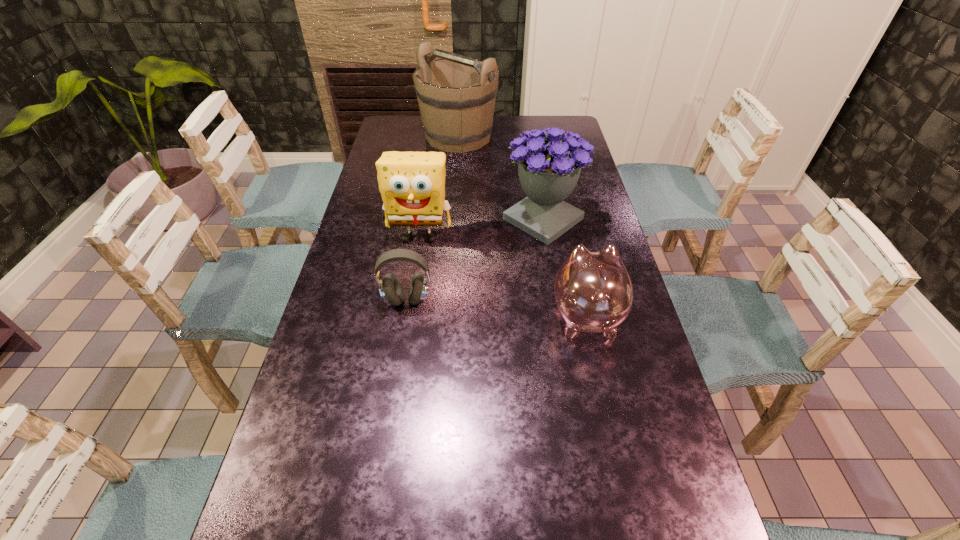
Locate an element on the screen. The image size is (960, 540). free location located on the front facing side of the piggy bank is located at coordinates (562, 204).

Image resolution: width=960 pixels, height=540 pixels. In order to click on free space located on the ear cups of the headset in this screenshot , I will do `click(401, 330)`.

Where is `object that is at the far edge`? Image resolution: width=960 pixels, height=540 pixels. object that is at the far edge is located at coordinates (456, 94).

This screenshot has height=540, width=960. Identify the location of bucket that is at the left edge. 456,94.

This screenshot has width=960, height=540. I want to click on sponge that is at the left edge, so click(x=412, y=184).

The image size is (960, 540). I want to click on headset situated at the left edge, so click(390, 288).

Where is `bouquet at the right edge`? This screenshot has width=960, height=540. bouquet at the right edge is located at coordinates (549, 170).

Identify the location of piggy bank that is at the right edge. (593, 290).

Identify the location of object that is at the far left corner. (456, 94).

At what (x,y) coordinates should I click in order to perform the action: click on vacant region at the left edge of the desktop. Please return your answer as a coordinate pair (x, y). Looking at the image, I should click on (379, 150).